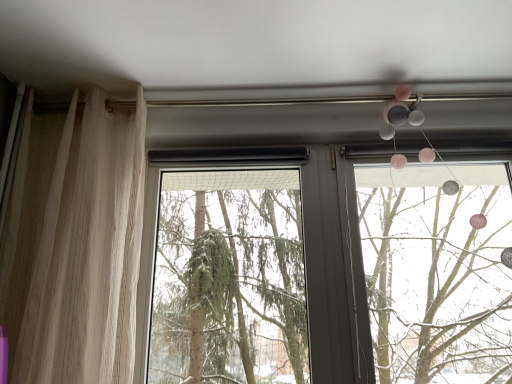
Question: From a real-world perspective, is sheer beige curtain at left above or below green matte tree at center?

Choices:
 (A) above
 (B) below

Answer: (A)

Question: Is sheer beige curtain at left bigger or smaller than green matte tree at center?

Choices:
 (A) big
 (B) small

Answer: (A)

Question: Based on their relative distances, which object is farther from the green matte tree at center?

Choices:
 (A) matte plastic mobile at upper right
 (B) sheer beige curtain at left

Answer: (B)

Question: Which object is the farthest from the matte plastic mobile at upper right?

Choices:
 (A) sheer beige curtain at left
 (B) green matte tree at center

Answer: (A)